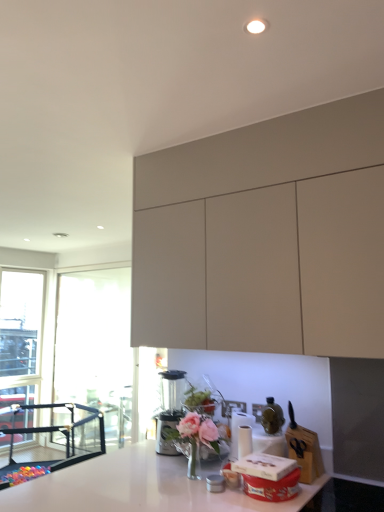
This screenshot has width=384, height=512. What do you see at coordinates (170, 408) in the screenshot? I see `satin silver blender at lower center` at bounding box center [170, 408].

What do you see at coordinates (55, 442) in the screenshot?
I see `black mesh playpen at lower left` at bounding box center [55, 442].

At what (x,y) coordinates should I click in order to perform the action: click on matte white cabinets at upper center. Please return your answer as a coordinate pair (x, y). The width and height of the screenshot is (384, 512). Looking at the image, I should click on (266, 269).

Which is behind, matte white cabinets at upper center or pink glass vase at center?

pink glass vase at center is further from the camera.

From a real-world perspective, is matte white cabinets at upper center on top of pink glass vase at center?

Yes, from a real-world perspective, matte white cabinets at upper center is on top of pink glass vase at center.

Does point (170, 247) appear closer or farther from the camera than point (194, 439)?

Point (170, 247).

Considering the sizes of objects pink glass vase at center and satin silver blender at lower center in the image provided, who is taller, pink glass vase at center or satin silver blender at lower center?

satin silver blender at lower center is taller.

Is pink glass vase at center next to satin silver blender at lower center and touching it?

pink glass vase at center is not next to satin silver blender at lower center, and they're not touching.

Based on the photo, how many degrees apart are the facing directions of pink glass vase at center and satin silver blender at lower center?

pink glass vase at center and satin silver blender at lower center are facing 15 degrees away from each other.

Consider the image. Do you think pink glass vase at center is within satin silver blender at lower center, or outside of it?

pink glass vase at center is not enclosed by satin silver blender at lower center.

Which is more distant, (257, 293) or (179, 417)?

The point (179, 417) is farther from the camera.

Could you tell me if matte white cabinets at upper center is turned towards satin silver blender at lower center?

No, matte white cabinets at upper center is not turned towards satin silver blender at lower center.

The image size is (384, 512). In the image, there is a satin silver blender at lower center. What are the coordinates of `cabinetry above it (from the image's perspective)` in the screenshot? It's located at (266, 269).

Is the position of matte white cabinets at upper center less distant than that of satin silver blender at lower center?

Yes, the depth of matte white cabinets at upper center is less than that of satin silver blender at lower center.

Does point (188, 416) come closer to viewer compared to point (170, 342)?

Yes, it is.

Looking at this image, is pink glass vase at center turned away from matte white cabinets at upper center?

No, matte white cabinets at upper center is not at the back of pink glass vase at center.

Considering the relative sizes of pink glass vase at center and matte white cabinets at upper center in the image provided, is pink glass vase at center shorter than matte white cabinets at upper center?

Yes.

You are a GUI agent. You are given a task and a screenshot of the screen. Output one action in this format:
    pyautogui.click(x=<x>, y=<y>)
    Task: Click on the floral arrangement below the matte white cabinets at upper center (from a real-world perspective)
    The image size is (384, 512).
    Given the screenshot: What is the action you would take?
    pyautogui.click(x=194, y=437)

Does satin silver blender at lower center have a lesser width compared to matte white cabinets at upper center?

Yes.

Visually, is satin silver blender at lower center positioned to the left or to the right of matte white cabinets at upper center?

Based on their positions, satin silver blender at lower center is located to the left of matte white cabinets at upper center.

Is satin silver blender at lower center looking in the opposite direction of matte white cabinets at upper center?

No.

How distant is satin silver blender at lower center from matte white cabinets at upper center?

The distance of satin silver blender at lower center from matte white cabinets at upper center is 32.00 inches.

Can you confirm if black mesh playpen at lower left is bigger than satin silver blender at lower center?

Indeed, black mesh playpen at lower left has a larger size compared to satin silver blender at lower center.

Can you tell me how much black mesh playpen at lower left and satin silver blender at lower center differ in facing direction?

77.2 degrees separate the facing orientations of black mesh playpen at lower left and satin silver blender at lower center.

From a real-world perspective, which is physically above, black mesh playpen at lower left or satin silver blender at lower center?

satin silver blender at lower center, from a real-world perspective.

Visually, is black mesh playpen at lower left positioned to the left or to the right of satin silver blender at lower center?

black mesh playpen at lower left is positioned on satin silver blender at lower center's left side.

Which is in front, satin silver blender at lower center or pink glass vase at center?

pink glass vase at center is more forward.

Does point (161, 417) appear closer or farther from the camera than point (204, 442)?

Clearly, point (161, 417) is more distant from the camera than point (204, 442).

Is satin silver blender at lower center to the left or to the right of pink glass vase at center in the image?

Clearly, satin silver blender at lower center is on the left of pink glass vase at center in the image.

Locate an element on the screen. cabinetry above the pink glass vase at center (from the image's perspective) is located at coordinates (266, 269).

This screenshot has height=512, width=384. In order to click on floral arrangement that appears on the right of satin silver blender at lower center in this screenshot , I will do [194, 437].

From the picture: Based on their spatial positions, is satin silver blender at lower center or pink glass vase at center closer to black mesh playpen at lower left?

satin silver blender at lower center is closer to black mesh playpen at lower left.

Which object lies nearer to the anchor point satin silver blender at lower center, matte white cabinets at upper center or black mesh playpen at lower left?

matte white cabinets at upper center lies closer to satin silver blender at lower center than the other object.

Looking at the image, which one is located further to satin silver blender at lower center, pink glass vase at center or matte white cabinets at upper center?

matte white cabinets at upper center.

Which object lies further to the anchor point pink glass vase at center, matte white cabinets at upper center or black mesh playpen at lower left?

The object further to pink glass vase at center is black mesh playpen at lower left.

Which object lies further to the anchor point black mesh playpen at lower left, pink glass vase at center or satin silver blender at lower center?

pink glass vase at center.

Considering their positions, is black mesh playpen at lower left positioned closer to satin silver blender at lower center than pink glass vase at center?

pink glass vase at center lies closer to satin silver blender at lower center than the other object.

Considering their positions, is satin silver blender at lower center positioned further to matte white cabinets at upper center than pink glass vase at center?

satin silver blender at lower center is positioned further to the anchor matte white cabinets at upper center.

Estimate the real-world distances between objects in this image. Which object is closer to pink glass vase at center, matte white cabinets at upper center or satin silver blender at lower center?

The object closer to pink glass vase at center is satin silver blender at lower center.

Locate an element on the screen. Image resolution: width=384 pixels, height=512 pixels. coffee machine between black mesh playpen at lower left and pink glass vase at center from left to right is located at coordinates (170, 408).

What are the coordinates of `coffee machine between matte white cabinets at upper center and black mesh playpen at lower left from top to bottom` in the screenshot? It's located at (170, 408).

The image size is (384, 512). I want to click on floral arrangement between black mesh playpen at lower left and matte white cabinets at upper center from left to right, so click(194, 437).

The image size is (384, 512). In order to click on floral arrangement between matte white cabinets at upper center and satin silver blender at lower center in the vertical direction in this screenshot , I will do `click(194, 437)`.